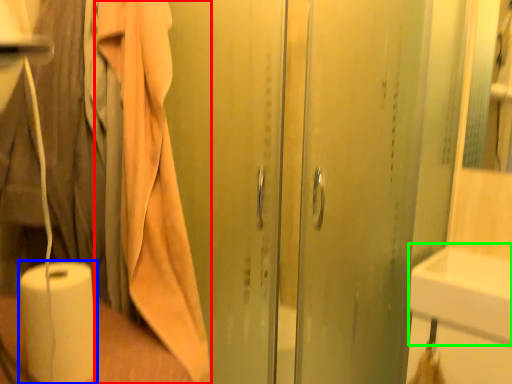
Question: Considering the real-world distances, which object is farthest from bath towel (highlighted by a red box)? paper towel (highlighted by a blue box) or sink (highlighted by a green box)?

Choices:
 (A) paper towel
 (B) sink

Answer: (B)